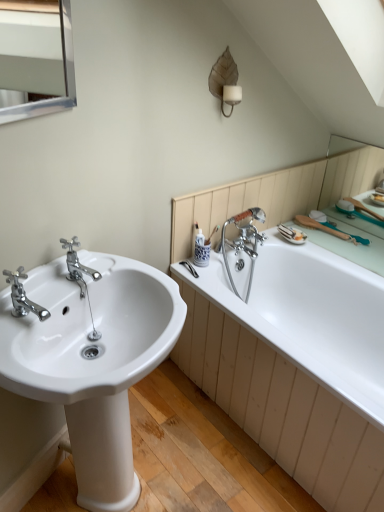
Identify the location of vacant space behind chrome metallic faucet at left, which appears as the 2th tap when viewed from the back. Image resolution: width=384 pixels, height=512 pixels. (56, 289).